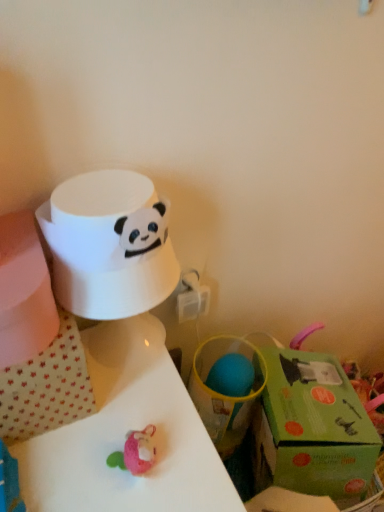
Question: Is white glossy table at center beside green cardboard gift box at lower right?

Choices:
 (A) yes
 (B) no

Answer: (B)

Question: Considering the relative positions of white glossy table at center and green cardboard gift box at lower right in the image provided, is white glossy table at center behind green cardboard gift box at lower right?

Choices:
 (A) no
 (B) yes

Answer: (A)

Question: From a real-world perspective, does white glossy table at center sit lower than green cardboard gift box at lower right?

Choices:
 (A) no
 (B) yes

Answer: (B)

Question: Considering the relative sizes of white glossy table at center and green cardboard gift box at lower right in the image provided, is white glossy table at center thinner than green cardboard gift box at lower right?

Choices:
 (A) no
 (B) yes

Answer: (A)

Question: Is white glossy table at center looking in the opposite direction of green cardboard gift box at lower right?

Choices:
 (A) yes
 (B) no

Answer: (B)

Question: Considering the relative sizes of white glossy table at center and green cardboard gift box at lower right in the image provided, is white glossy table at center taller than green cardboard gift box at lower right?

Choices:
 (A) no
 (B) yes

Answer: (B)

Question: Does white matte paper towel at upper left have a greater width compared to white glossy table at center?

Choices:
 (A) yes
 (B) no

Answer: (B)

Question: Is white matte paper towel at upper left thinner than white glossy table at center?

Choices:
 (A) no
 (B) yes

Answer: (B)

Question: Would you consider white matte paper towel at upper left to be distant from white glossy table at center?

Choices:
 (A) yes
 (B) no

Answer: (B)

Question: Is white matte paper towel at upper left at the right side of white glossy table at center?

Choices:
 (A) no
 (B) yes

Answer: (B)

Question: From the image's perspective, does white matte paper towel at upper left appear higher than white glossy table at center?

Choices:
 (A) no
 (B) yes

Answer: (B)

Question: Is white matte paper towel at upper left bigger than white glossy table at center?

Choices:
 (A) yes
 (B) no

Answer: (B)

Question: Is green cardboard gift box at lower right directly adjacent to white glossy table at center?

Choices:
 (A) no
 (B) yes

Answer: (A)